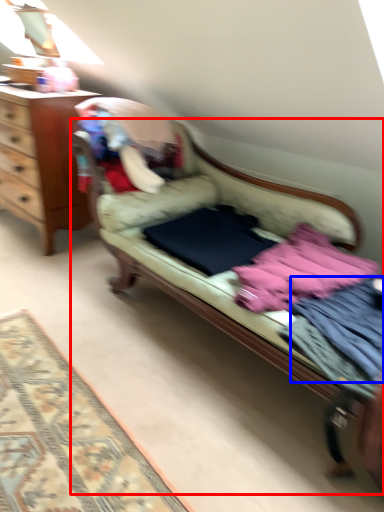
Question: Which object is closer to the camera taking this photo, studio couch (highlighted by a red box) or clothing (highlighted by a blue box)?

Choices:
 (A) studio couch
 (B) clothing

Answer: (A)